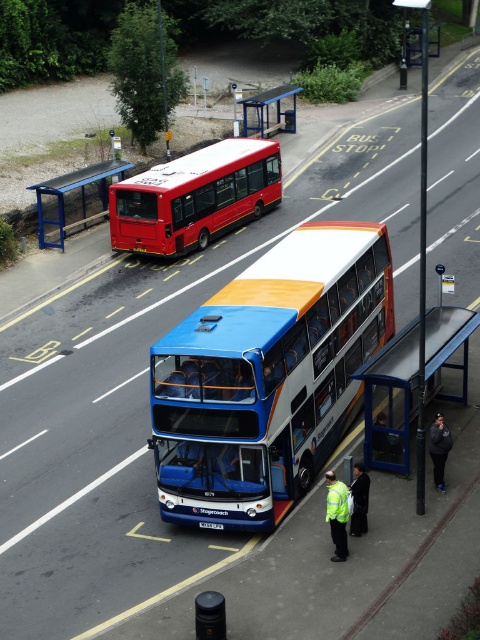
You are standing at the bus stop and want to board the blue metallic decker bus at center. Which side of the blue metal bus stop at upper left should you approach from?

You should approach from the right side of the blue metal bus stop at upper left because the blue metallic decker bus at center is positioned on the right side of it.

You are a pedestrian trying to cross the road safely. You see a blue metallic decker bus at center and a matte red bus at center. Which bus is wider, and how might that affect your decision to cross?

The matte red bus at center is wider than the blue metallic decker bus at center. When crossing, you should be cautious of the wider matte red bus as it may block your view or require more space, so wait until it has passed before proceeding.